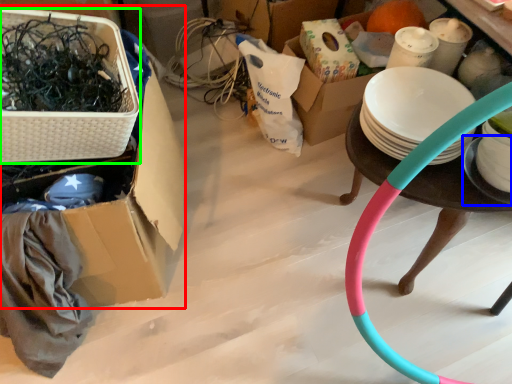
Question: Which is farther away from box (highlighted by a red box)? plate (highlighted by a blue box) or basket (highlighted by a green box)?

Choices:
 (A) plate
 (B) basket

Answer: (A)